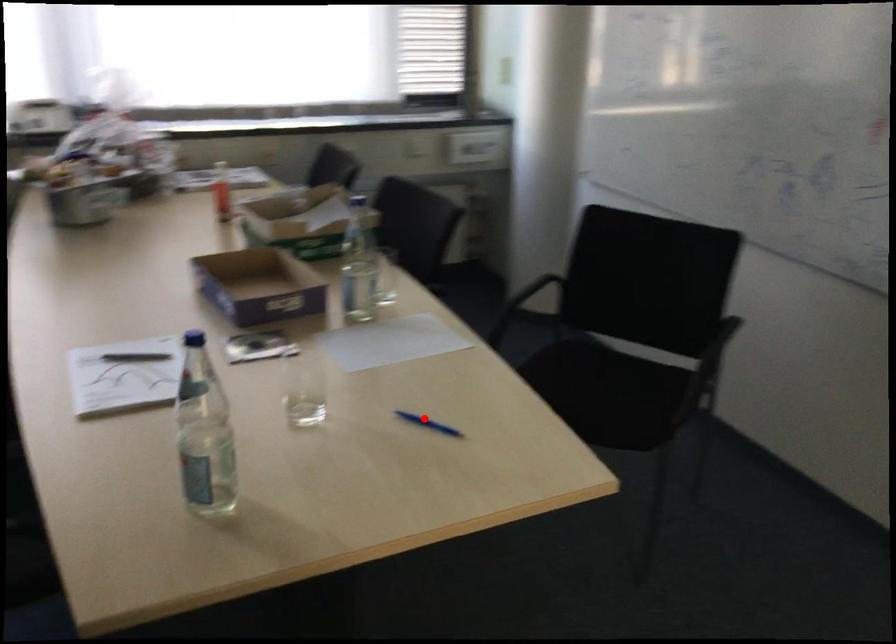
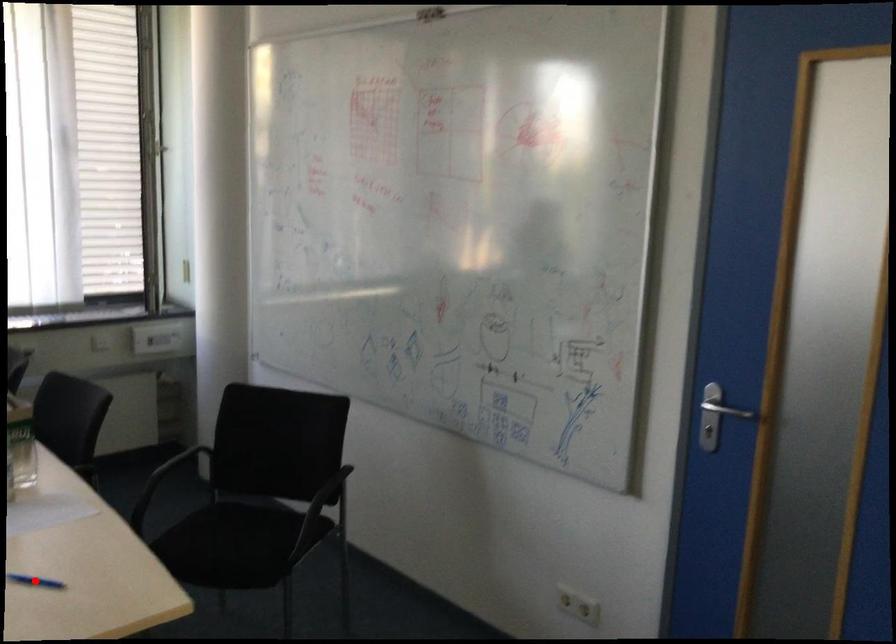
I am providing you with two images of the same scene from different viewpoints. A red point is marked on the first image and another point is marked on the second image. Are the points marked in image1 and image2 representing the same 3D position?

Yes